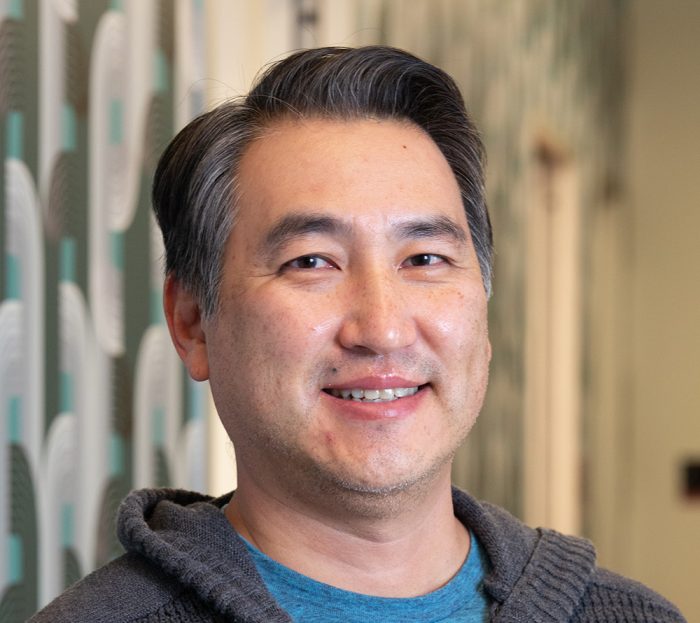
Locate an element on the screen. The width and height of the screenshot is (700, 623). curtain is located at coordinates (119, 330).